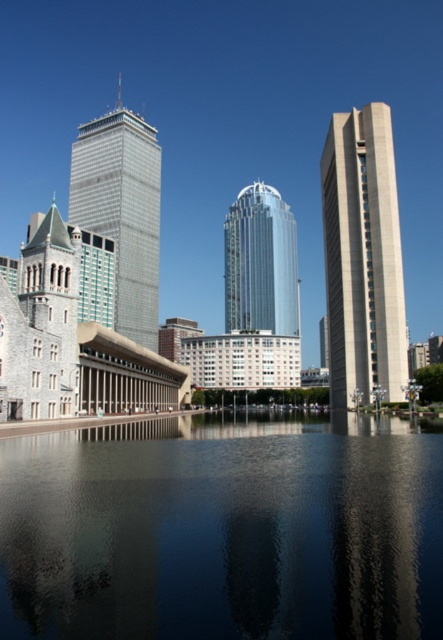
Question: Which of these objects is positioned farthest from the beige concrete tower at right?

Choices:
 (A) glossy glass tower at center
 (B) black reflective water at center
 (C) metallic glass skyscraper at center

Answer: (A)

Question: Does black reflective water at center appear under beige concrete tower at right?

Choices:
 (A) no
 (B) yes

Answer: (B)

Question: Does black reflective water at center have a greater width compared to beige concrete tower at right?

Choices:
 (A) no
 (B) yes

Answer: (B)

Question: Which point appears farthest from the camera in this image?

Choices:
 (A) pyautogui.click(x=248, y=298)
 (B) pyautogui.click(x=356, y=244)
 (C) pyautogui.click(x=310, y=573)

Answer: (A)

Question: Considering the real-world distances, which object is farthest from the beige concrete tower at right?

Choices:
 (A) metallic glass skyscraper at center
 (B) black reflective water at center
 (C) glossy glass tower at center

Answer: (C)

Question: Observing the image, what is the correct spatial positioning of beige concrete tower at right in reference to metallic glass skyscraper at center?

Choices:
 (A) left
 (B) right

Answer: (B)